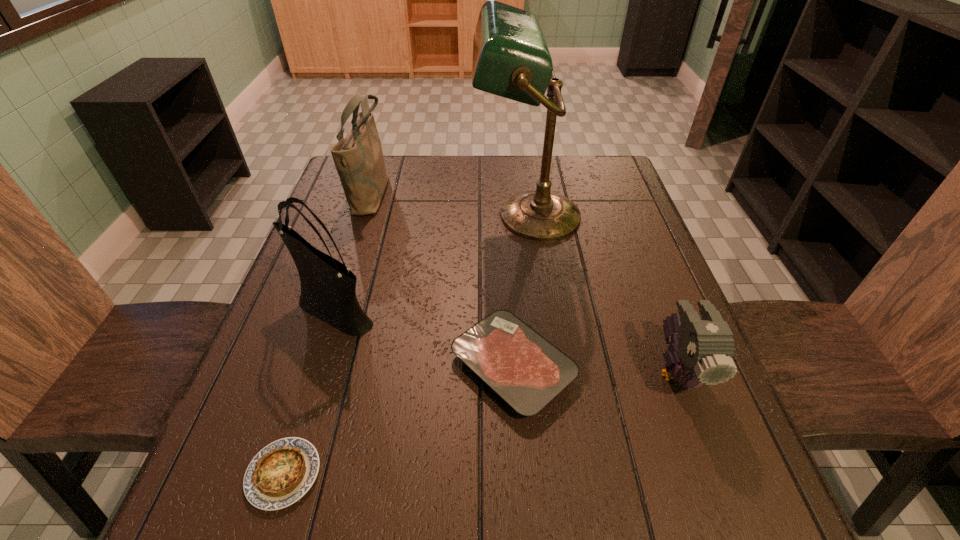
The width and height of the screenshot is (960, 540). Identify the location of the tallest object. (511, 59).

What are the coordinates of `the farther shoulder bag` in the screenshot? It's located at (358, 157).

Locate an element on the screen. the nearer shoulder bag is located at coordinates (328, 288).

At what (x,y) coordinates should I click in order to perform the action: click on the rightmost object. Please return your answer as a coordinate pair (x, y). The width and height of the screenshot is (960, 540). Looking at the image, I should click on (702, 352).

Where is `the third shortest object`? This screenshot has width=960, height=540. the third shortest object is located at coordinates (702, 352).

Where is `steak`? The width and height of the screenshot is (960, 540). steak is located at coordinates (527, 371).

The image size is (960, 540). In order to click on quiche in this screenshot , I will do `click(280, 474)`.

Locate an element on the screen. the shortest object is located at coordinates (280, 474).

Find the location of a particular element. vacant space situated above the green lampshade of the tallest object is located at coordinates (341, 216).

You are a GUI agent. You are given a task and a screenshot of the screen. Output one action in this format:
    pyautogui.click(x=<x>, y=<y>)
    Task: Click on the vacant region located above the green lampshade of the tallest object
    
    Given the screenshot: What is the action you would take?
    pyautogui.click(x=456, y=216)